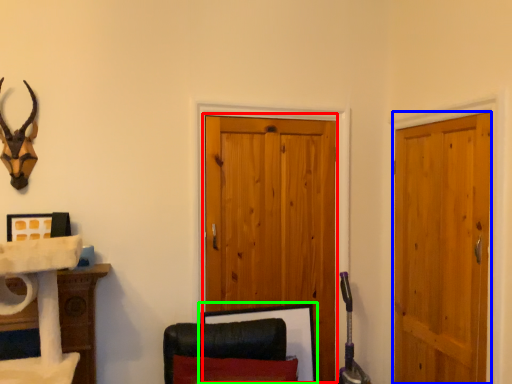
Question: Considering the real-world distances, which object is closest to barn door (highlighted by a red box)? door (highlighted by a blue box) or picture frame (highlighted by a green box).

Choices:
 (A) door
 (B) picture frame

Answer: (B)